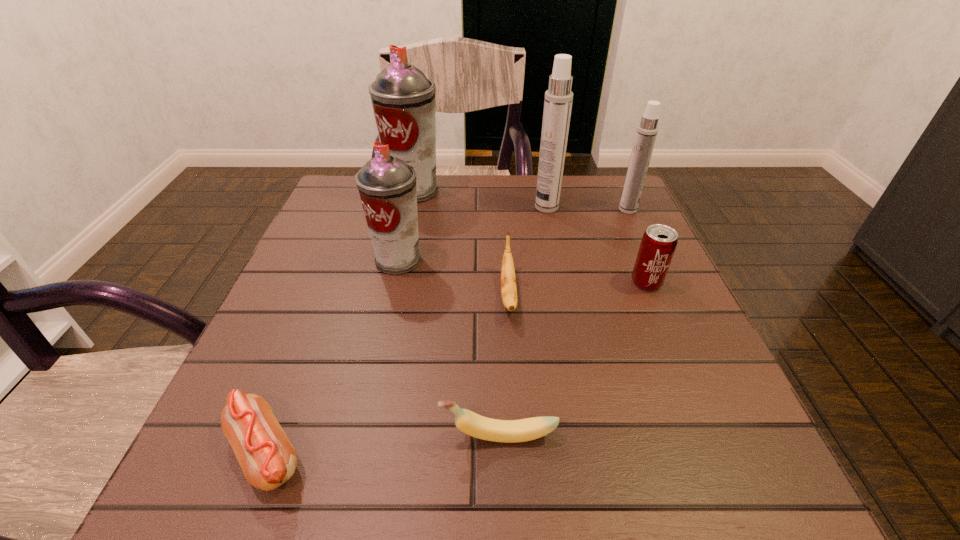
You are a GUI agent. You are given a task and a screenshot of the screen. Output one action in this format:
    pyautogui.click(x=<x>, y=<y>)
    Task: Click on the free region at the far edge
    The width and height of the screenshot is (960, 540).
    Given the screenshot: What is the action you would take?
    pyautogui.click(x=443, y=192)

The width and height of the screenshot is (960, 540). In the image, there is a desktop. What are the coordinates of `vacant space at the near edge` in the screenshot? It's located at (337, 491).

Identify the location of free region at the left edge of the desktop. (275, 314).

The height and width of the screenshot is (540, 960). Identify the location of vacant area at the right edge of the desktop. (587, 240).

This screenshot has width=960, height=540. Find the location of `vacant space at the far left corner`. vacant space at the far left corner is located at coordinates (350, 218).

At what (x,y) coordinates should I click in order to perform the action: click on vacant area at the near right corner of the desktop. Please return your answer as a coordinate pair (x, y). The width and height of the screenshot is (960, 540). Looking at the image, I should click on (716, 476).

This screenshot has height=540, width=960. Find the location of `free space between the nearer yellow banana and the farther gray aerosol can`. free space between the nearer yellow banana and the farther gray aerosol can is located at coordinates (456, 313).

The image size is (960, 540). I want to click on free space between the shortest object and the farther yellow banana, so click(387, 374).

The image size is (960, 540). Find the location of `vacant space in between the nearer yellow banana and the beer can`. vacant space in between the nearer yellow banana and the beer can is located at coordinates (572, 359).

Where is `unoccupied position between the left white aerosol can and the nearer banana`? unoccupied position between the left white aerosol can and the nearer banana is located at coordinates (522, 321).